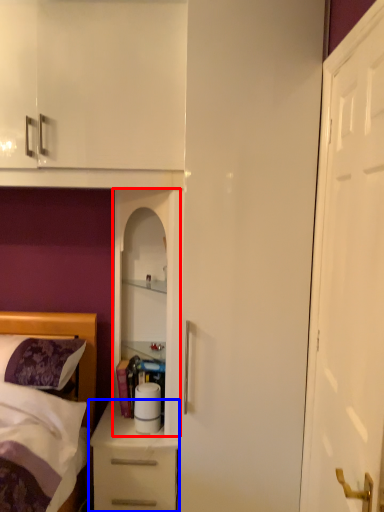
Question: Which object is further to the camera taking this photo, cabinetry (highlighted by a red box) or chest of drawers (highlighted by a blue box)?

Choices:
 (A) cabinetry
 (B) chest of drawers

Answer: (B)